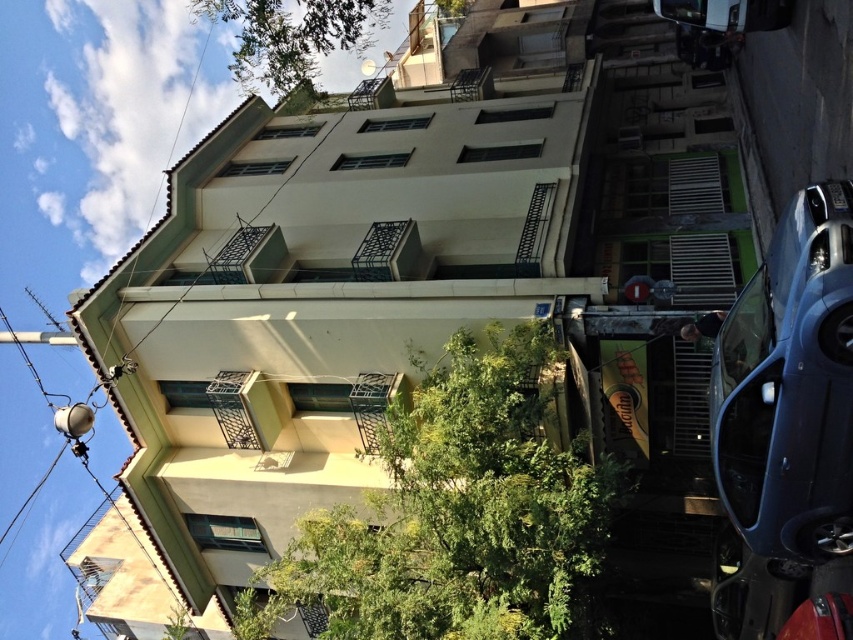
Question: Can you confirm if green leafy tree at center is smaller than metallic blue sedan at right?

Choices:
 (A) no
 (B) yes

Answer: (B)

Question: Can you confirm if green leafy tree at center is positioned to the left of metallic blue sedan at right?

Choices:
 (A) no
 (B) yes

Answer: (B)

Question: Which of the following is the closest to the observer?

Choices:
 (A) metallic blue sedan at right
 (B) green leafy tree at upper center

Answer: (A)

Question: Which point is closer to the camera?

Choices:
 (A) green leafy tree at center
 (B) green leafy tree at upper center

Answer: (A)

Question: Among these points, which one is farthest from the camera?

Choices:
 (A) (761, 451)
 (B) (462, 493)
 (C) (379, 1)

Answer: (C)

Question: Is metallic blue sedan at right to the left of green leafy tree at upper center from the viewer's perspective?

Choices:
 (A) no
 (B) yes

Answer: (A)